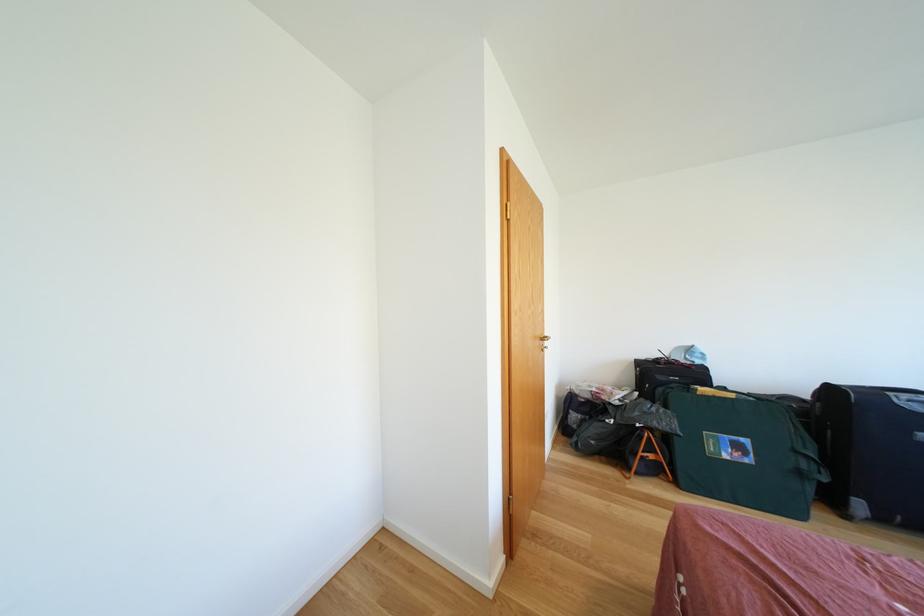
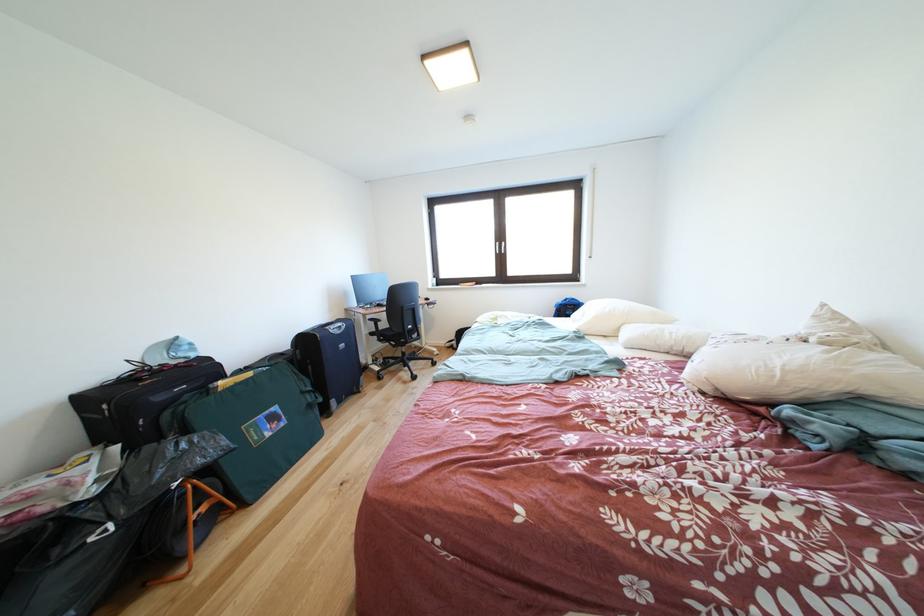
The point at [739,400] is marked in the first image. Where is the corresponding point in the second image?

(259, 379)